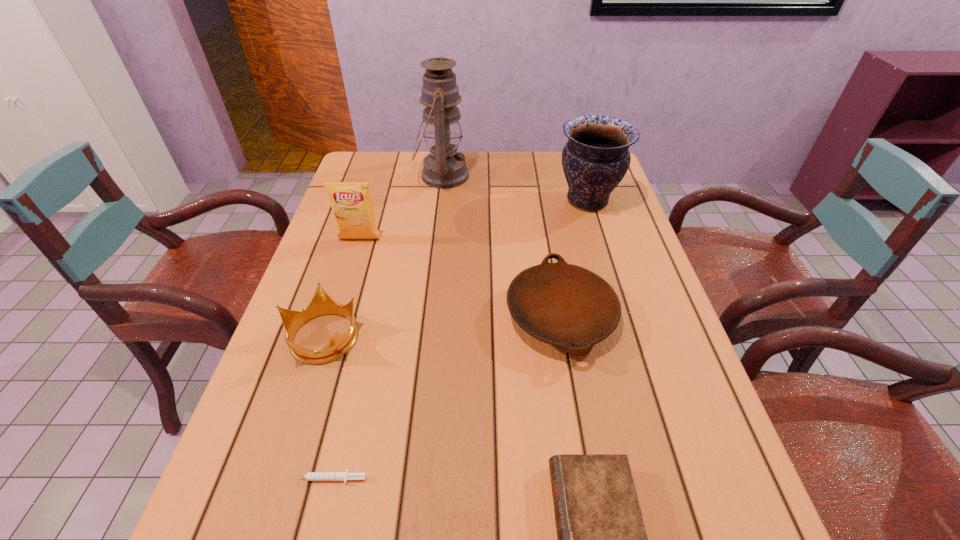
I want to click on pottery that is at the right edge, so click(x=595, y=159).

This screenshot has height=540, width=960. Find the location of `plate situated at the right edge`. plate situated at the right edge is located at coordinates (564, 305).

At what (x,y) coordinates should I click in order to perform the action: click on object that is at the far right corner. Please return your answer as a coordinate pair (x, y). This screenshot has width=960, height=540. Looking at the image, I should click on (595, 159).

Identify the location of free spot at the far edge of the desktop. The height and width of the screenshot is (540, 960). (494, 152).

Identify the location of vacant space at the left edge. The width and height of the screenshot is (960, 540). (346, 296).

Where is `vacant space at the right edge`? Image resolution: width=960 pixels, height=540 pixels. vacant space at the right edge is located at coordinates (694, 395).

The width and height of the screenshot is (960, 540). In the image, there is a desktop. In order to click on vacant space at the far left corner in this screenshot , I will do `click(379, 181)`.

Identify the location of free point between the shortest object and the pottery. Image resolution: width=960 pixels, height=540 pixels. (457, 339).

Find the location of a particular element. The height and width of the screenshot is (540, 960). free space between the pottery and the oil lamp is located at coordinates click(x=515, y=188).

Find the location of a particular element. This screenshot has height=540, width=960. free space between the fifth tallest object and the oil lamp is located at coordinates (501, 246).